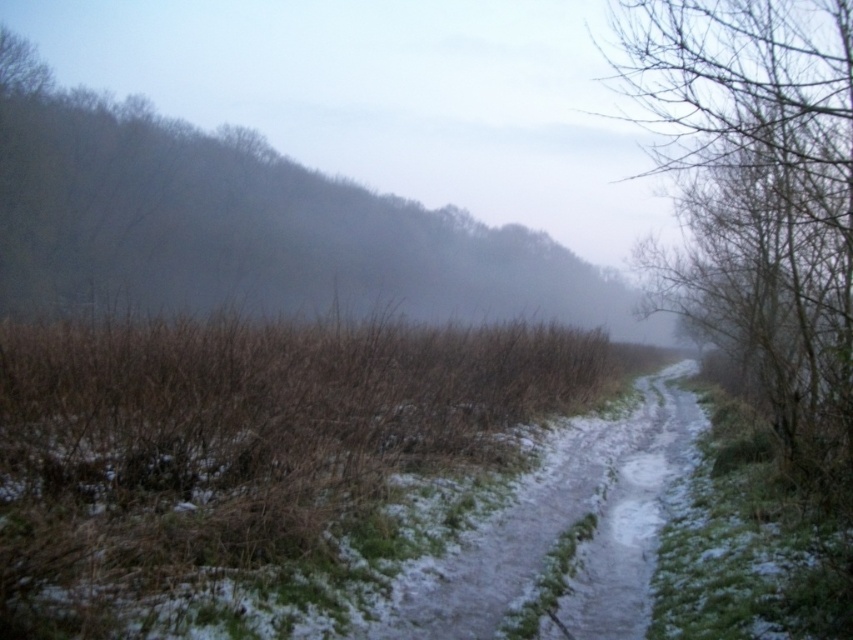
You are walking along the sandy dirt trail at center and notice the bare branches at right. From your perspective, which object is closer to you?

The bare branches at right are closer to you because they are positioned in front of the sandy dirt trail at center.

You are a hiker trying to follow the sandy dirt trail at center. There are bare branches at right nearby. Which direction should you go to stay on the trail?

The sandy dirt trail at center is narrower than the bare branches at right. To stay on the trail, you should move toward the narrower path, so head away from the bare branches at right.